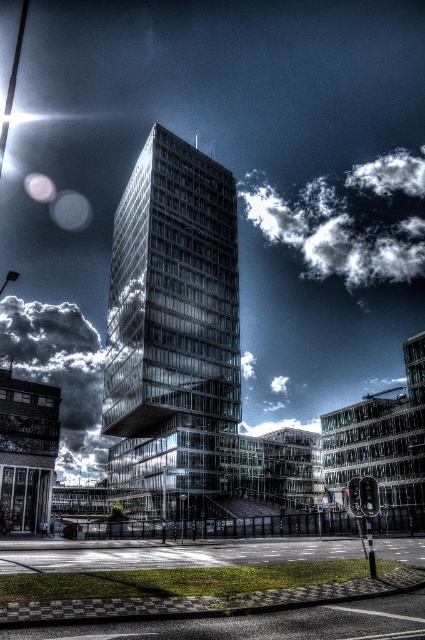
Looking at this image, you are an architect designing a new skyscraper and want to ensure that the building doesn not block the view of the white fluffy cloud at upper right from the observation deck. The observation deck is located at point (x=334, y=234). Can you confirm if the skyscraper will block the view of the white fluffy cloud at upper right from this point?

The point (x=334, y=234) indicates the location of the white fluffy cloud at upper right, so the skyscraper will not block the view of the white fluffy cloud at upper right from this point because the cloud is exactly at that location.